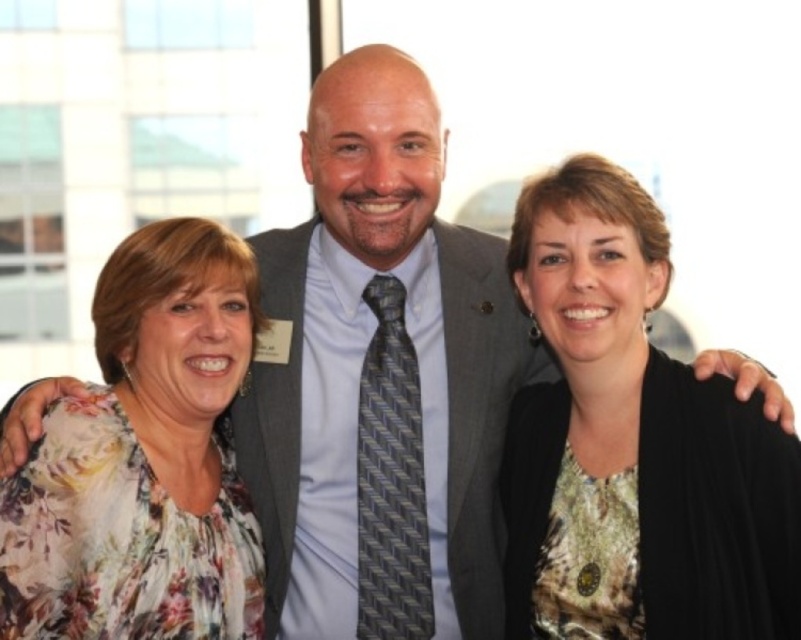
You are taking a photo of the three people in the scene. You want to focus on the person at point (119, 472) and the person at point (505, 384). Which of these two points should you adjust your focus to first to ensure both are in sharp focus?

Point (119, 472) is closer to the camera than point (505, 384). To ensure both are in sharp focus, you should focus on the closer point first, so adjust your focus to point (119, 472) first.

You are a photographer arranging a group photo. You have the floral fabric blouse at left and the gray textured suit at center in your frame. Based on their positions, which clothing item is higher up in the image?

The floral fabric blouse at left is located above the gray textured suit at center, so it is higher up in the image.